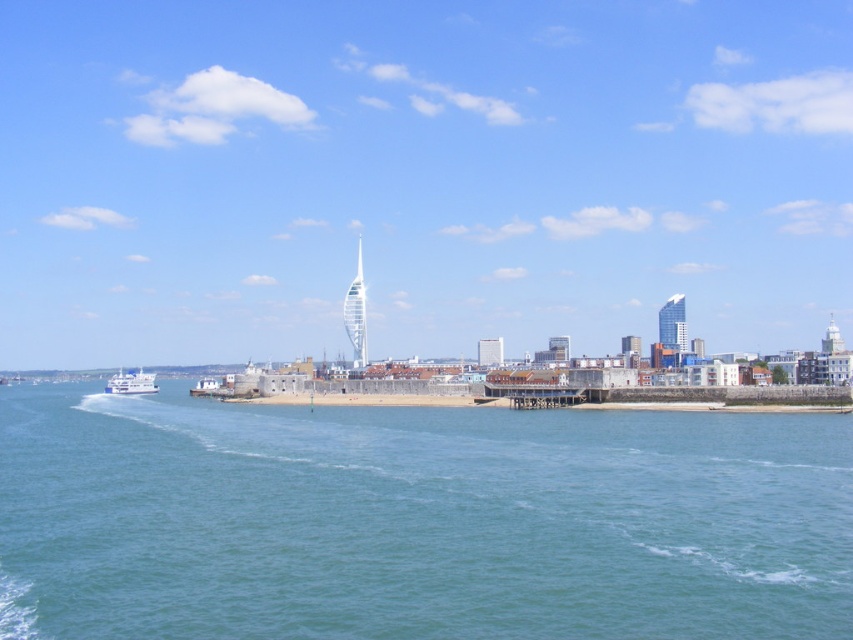
You are a tourist planning to take a photo of the transparent glass skyline at center and the white glossy ferry at lower left. Which object should you frame first in your camera to ensure both fit in the shot?

You should frame the transparent glass skyline at center first since it is wider than the white glossy ferry at lower left, ensuring there is enough space for both in the photo.

You are a photographer planning to capture the entire scene of the coastal cityscape. You have a camera with a standard lens that can only focus on objects up to 10 meters away. Considering the transparent glass skyline at center and the white glossy ferry at lower left, which object will be in focus and which will be blurry?

The white glossy ferry at lower left will be in focus because it is closer to the photographer than the transparent glass skyline at center, which is farther away and beyond the 10 meters focus range.

You are a tourist standing on the beach and want to take a photo of the white glossy ferry at lower left with the city skyline in the background. Can you position yourself so that the clear blue water at lower center doesn not block the view of the ferry?

The clear blue water at lower center is in front of the white glossy ferry at lower left, so positioning yourself behind the clear blue water at lower center would block the view of the ferry. To ensure the ferry is visible with the city skyline, you should position yourself so that the white glossy ferry at lower left is in front of the clear blue water at lower center.